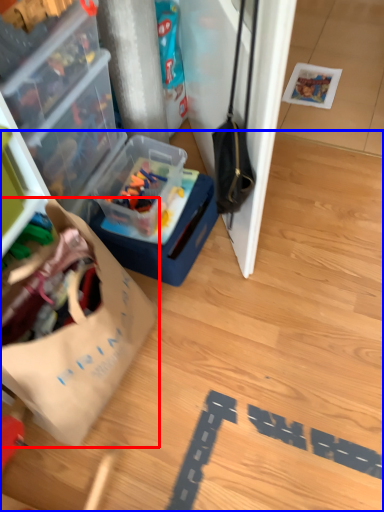
Question: Which of the following is the closest to the observer, wrapping paper (highlighted by a red box) or wood (highlighted by a blue box)?

Choices:
 (A) wrapping paper
 (B) wood

Answer: (A)